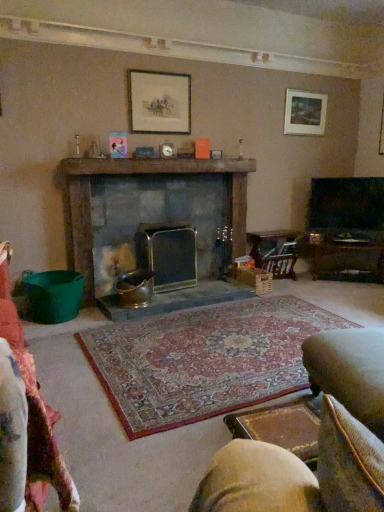
What is the approximate height of wooden magazine rack at center-right?

20.85 inches.

The image size is (384, 512). I want to click on wooden magazine rack at center-right, so click(276, 251).

At what (x,y) coordinates should I click in order to perform the action: click on metallic silver fireplace at center, the second fireplace viewed from the left. Please return your answer as a coordinate pair (x, y). This screenshot has height=512, width=384. Looking at the image, I should click on (168, 254).

Locate an element on the screen. The width and height of the screenshot is (384, 512). matte wooden picture frame at upper center, arranged as the first picture frame when viewed from the front is located at coordinates (159, 102).

The image size is (384, 512). Describe the element at coordinates (159, 102) in the screenshot. I see `matte wooden picture frame at upper center, which is the second picture frame in right-to-left order` at that location.

Locate an element on the screen. The image size is (384, 512). matte wooden picture frame at upper right, which is the 2th picture frame in left-to-right order is located at coordinates (304, 113).

The width and height of the screenshot is (384, 512). Find the location of `velvet beige swivel chair at lower right, acting as the 2th swivel chair starting from the front`. velvet beige swivel chair at lower right, acting as the 2th swivel chair starting from the front is located at coordinates (349, 371).

This screenshot has width=384, height=512. In order to click on leather cushioned swivel chair at lower right, the first swivel chair from the front in this screenshot , I will do 318,440.

Image resolution: width=384 pixels, height=512 pixels. I want to click on picture frame that is on the right side of rustic stone fireplace at center, which is counted as the 1th fireplace, starting from the left, so click(x=304, y=113).

Is matte wooden picture frame at upper right, which ranks as the first picture frame in right-to-left order, surrounding rustic stone fireplace at center, which is counted as the 1th fireplace, starting from the left?

No, matte wooden picture frame at upper right, which ranks as the first picture frame in right-to-left order, does not contain rustic stone fireplace at center, which is counted as the 1th fireplace, starting from the left.

Looking at the image, does matte wooden picture frame at upper right, the 1th picture frame viewed from the back, seem bigger or smaller compared to rustic stone fireplace at center, positioned as the 2th fireplace in right-to-left order?

Considering their sizes, matte wooden picture frame at upper right, the 1th picture frame viewed from the back, takes up less space than rustic stone fireplace at center, positioned as the 2th fireplace in right-to-left order.

Is matte wooden picture frame at upper right, which ranks as the first picture frame in right-to-left order, taller than rustic stone fireplace at center, which is counted as the 1th fireplace, starting from the left?

No.

Measure the distance between rustic stone fireplace at center, which is counted as the 1th fireplace, starting from the left, and leather cushioned swivel chair at lower right, the first swivel chair from the front.

They are 2.21 meters apart.

Is rustic stone fireplace at center, which is counted as the 1th fireplace, starting from the left, at the right side of leather cushioned swivel chair at lower right, positioned as the second swivel chair in right-to-left order?

No, rustic stone fireplace at center, which is counted as the 1th fireplace, starting from the left, is not to the right of leather cushioned swivel chair at lower right, positioned as the second swivel chair in right-to-left order.

Consider the image. Is rustic stone fireplace at center, which is counted as the 1th fireplace, starting from the left, facing towards leather cushioned swivel chair at lower right, arranged as the 2th swivel chair when viewed from the back?

Yes, rustic stone fireplace at center, which is counted as the 1th fireplace, starting from the left, is turned towards leather cushioned swivel chair at lower right, arranged as the 2th swivel chair when viewed from the back.

Between rustic stone fireplace at center, which is counted as the 1th fireplace, starting from the left, and leather cushioned swivel chair at lower right, the first swivel chair from the front, which one has larger size?

With larger size is rustic stone fireplace at center, which is counted as the 1th fireplace, starting from the left.

At what (x,y) coordinates should I click in order to perform the action: click on picture frame on the left of rustic stone fireplace at center, which is counted as the 1th fireplace, starting from the left. Please return your answer as a coordinate pair (x, y). The width and height of the screenshot is (384, 512). Looking at the image, I should click on (159, 102).

Is rustic stone fireplace at center, which is counted as the 1th fireplace, starting from the left, shorter than matte wooden picture frame at upper center, the first picture frame positioned from the left?

In fact, rustic stone fireplace at center, which is counted as the 1th fireplace, starting from the left, may be taller than matte wooden picture frame at upper center, the first picture frame positioned from the left.

From the image's perspective, relative to matte wooden picture frame at upper center, the first picture frame positioned from the left, is rustic stone fireplace at center, which is counted as the 1th fireplace, starting from the left, above or below?

From the image's perspective, rustic stone fireplace at center, which is counted as the 1th fireplace, starting from the left, appears below matte wooden picture frame at upper center, the first picture frame positioned from the left.

Which of these two, rustic stone fireplace at center, which is counted as the 1th fireplace, starting from the left, or matte wooden picture frame at upper center, arranged as the first picture frame when viewed from the front, is smaller?

With smaller size is matte wooden picture frame at upper center, arranged as the first picture frame when viewed from the front.

From a real-world perspective, is velvet beige swivel chair at lower right, acting as the 2th swivel chair starting from the front, under matte wooden picture frame at upper center, arranged as the first picture frame when viewed from the front?

Indeed, from a real-world perspective, velvet beige swivel chair at lower right, acting as the 2th swivel chair starting from the front, is positioned beneath matte wooden picture frame at upper center, arranged as the first picture frame when viewed from the front.

Is velvet beige swivel chair at lower right, acting as the 2th swivel chair starting from the front, far away from matte wooden picture frame at upper center, which is the second picture frame in right-to-left order?

Yes.

Considering the positions of objects velvet beige swivel chair at lower right, positioned as the second swivel chair in left-to-right order, and matte wooden picture frame at upper center, arranged as the first picture frame when viewed from the front, in the image provided, who is behind, velvet beige swivel chair at lower right, positioned as the second swivel chair in left-to-right order, or matte wooden picture frame at upper center, arranged as the first picture frame when viewed from the front,?

matte wooden picture frame at upper center, arranged as the first picture frame when viewed from the front, is further away from the camera.

From the image's perspective, is velvet beige swivel chair at lower right, acting as the 2th swivel chair starting from the front, located above or below matte wooden picture frame at upper center, arranged as the first picture frame when viewed from the front?

velvet beige swivel chair at lower right, acting as the 2th swivel chair starting from the front, is situated lower than matte wooden picture frame at upper center, arranged as the first picture frame when viewed from the front, in the image.

Is matte wooden picture frame at upper right, which is counted as the 2th picture frame, starting from the front, bigger than metallic silver fireplace at center, the second fireplace viewed from the left?

Incorrect, matte wooden picture frame at upper right, which is counted as the 2th picture frame, starting from the front, is not larger than metallic silver fireplace at center, the second fireplace viewed from the left.

Could you tell me if matte wooden picture frame at upper right, the 1th picture frame viewed from the back, is turned towards metallic silver fireplace at center, the second fireplace viewed from the left?

No.

From a real-world perspective, which is physically above, matte wooden picture frame at upper right, which is counted as the 2th picture frame, starting from the front, or metallic silver fireplace at center, which is counted as the 1th fireplace, starting from the right?

matte wooden picture frame at upper right, which is counted as the 2th picture frame, starting from the front, is physically above.

Measure the distance between matte wooden picture frame at upper right, the 1th picture frame viewed from the back, and metallic silver fireplace at center, which is counted as the 1th fireplace, starting from the right.

matte wooden picture frame at upper right, the 1th picture frame viewed from the back, is 1.82 meters from metallic silver fireplace at center, which is counted as the 1th fireplace, starting from the right.

Is wooden magazine rack at center-right facing away from matte wooden picture frame at upper center, arranged as the first picture frame when viewed from the front?

No, wooden magazine rack at center-right is not facing the opposite direction of matte wooden picture frame at upper center, arranged as the first picture frame when viewed from the front.

From the image's perspective, relative to matte wooden picture frame at upper center, the first picture frame positioned from the left, is wooden magazine rack at center-right above or below?

Based on their image positions, wooden magazine rack at center-right is located beneath matte wooden picture frame at upper center, the first picture frame positioned from the left.

Is point (258, 247) closer or farther from the camera than point (149, 133)?

Clearly, point (258, 247) is more distant from the camera than point (149, 133).

Could you measure the distance between wooden magazine rack at center-right and matte wooden picture frame at upper center, which is the second picture frame in right-to-left order?

wooden magazine rack at center-right is 1.54 meters from matte wooden picture frame at upper center, which is the second picture frame in right-to-left order.

Which is in front, matte wooden picture frame at upper center, the first picture frame positioned from the left, or wooden magazine rack at center-right?

Positioned in front is matte wooden picture frame at upper center, the first picture frame positioned from the left.

Image resolution: width=384 pixels, height=512 pixels. In order to click on table located behind the matte wooden picture frame at upper center, arranged as the first picture frame when viewed from the front in this screenshot , I will do `click(276, 251)`.

Between point (158, 88) and point (281, 238), which one is positioned behind?

The point (281, 238) is behind.

Which of these two, matte wooden picture frame at upper center, the second picture frame viewed from the back, or wooden magazine rack at center-right, stands taller?

With more height is matte wooden picture frame at upper center, the second picture frame viewed from the back.

Which fireplace is the 2nd one when counting from the left side of the matte wooden picture frame at upper right, which is the 2th picture frame in left-to-right order? Please provide its 2D coordinates.

[(133, 174)]

This screenshot has height=512, width=384. What are the coordinates of `the 1st fireplace behind the leather cushioned swivel chair at lower right, positioned as the second swivel chair in right-to-left order, counting from the anchor's position` in the screenshot? It's located at [x=133, y=174].

Based on their spatial positions, is matte wooden picture frame at upper center, the first picture frame positioned from the left, or velvet beige swivel chair at lower right, acting as the 2th swivel chair starting from the front, closer to metallic silver fireplace at center, which is counted as the 1th fireplace, starting from the right?

matte wooden picture frame at upper center, the first picture frame positioned from the left, lies closer to metallic silver fireplace at center, which is counted as the 1th fireplace, starting from the right, than the other object.

From the image, which object appears to be nearer to metallic silver fireplace at center, the second fireplace viewed from the left, velvet beige swivel chair at lower right, positioned as the second swivel chair in left-to-right order, or wooden magazine rack at center-right?

wooden magazine rack at center-right lies closer to metallic silver fireplace at center, the second fireplace viewed from the left, than the other object.

In the scene shown: When comparing their distances from matte wooden picture frame at upper center, the second picture frame viewed from the back, does velvet beige swivel chair at lower right, acting as the 2th swivel chair starting from the front, or rustic stone fireplace at center, which is counted as the 1th fireplace, starting from the left, seem further?

velvet beige swivel chair at lower right, acting as the 2th swivel chair starting from the front.

Estimate the real-world distances between objects in this image. Which object is closer to rustic stone fireplace at center, which is counted as the 1th fireplace, starting from the left, leather cushioned swivel chair at lower right, arranged as the 2th swivel chair when viewed from the back, or velvet beige swivel chair at lower right, positioned as the second swivel chair in left-to-right order?

leather cushioned swivel chair at lower right, arranged as the 2th swivel chair when viewed from the back, is positioned closer to the anchor rustic stone fireplace at center, which is counted as the 1th fireplace, starting from the left.

When comparing their distances from matte wooden picture frame at upper center, which is the second picture frame in right-to-left order, does wooden magazine rack at center-right or leather cushioned swivel chair at lower right, arranged as the 2th swivel chair when viewed from the back, seem further?

The object further to matte wooden picture frame at upper center, which is the second picture frame in right-to-left order, is leather cushioned swivel chair at lower right, arranged as the 2th swivel chair when viewed from the back.

From the picture: Based on their spatial positions, is metallic silver fireplace at center, the second fireplace viewed from the left, or matte wooden picture frame at upper center, arranged as the first picture frame when viewed from the front, closer to rustic stone fireplace at center, positioned as the 2th fireplace in right-to-left order?

Among the two, metallic silver fireplace at center, the second fireplace viewed from the left, is located nearer to rustic stone fireplace at center, positioned as the 2th fireplace in right-to-left order.

When comparing their distances from metallic silver fireplace at center, which is counted as the 1th fireplace, starting from the right, does rustic stone fireplace at center, positioned as the 2th fireplace in right-to-left order, or leather cushioned swivel chair at lower right, the first swivel chair from the front, seem further?

leather cushioned swivel chair at lower right, the first swivel chair from the front, is positioned further to the anchor metallic silver fireplace at center, which is counted as the 1th fireplace, starting from the right.

Based on the photo, from the image, which object appears to be nearer to matte wooden picture frame at upper right, which ranks as the first picture frame in right-to-left order, leather cushioned swivel chair at lower right, the first swivel chair from the front, or rustic stone fireplace at center, which is counted as the 1th fireplace, starting from the left?

rustic stone fireplace at center, which is counted as the 1th fireplace, starting from the left, lies closer to matte wooden picture frame at upper right, which ranks as the first picture frame in right-to-left order, than the other object.

Locate an element on the screen. The width and height of the screenshot is (384, 512). picture frame that lies between matte wooden picture frame at upper right, the 1th picture frame viewed from the back, and metallic silver fireplace at center, the second fireplace viewed from the left, from top to bottom is located at coordinates (159, 102).

The width and height of the screenshot is (384, 512). Identify the location of picture frame between leather cushioned swivel chair at lower right, the 1th swivel chair from the left, and matte wooden picture frame at upper right, the 1th picture frame viewed from the back, in the front-back direction. (159, 102).

I want to click on table between matte wooden picture frame at upper center, arranged as the first picture frame when viewed from the front, and metallic silver fireplace at center, which is counted as the 1th fireplace, starting from the right, from top to bottom, so click(276, 251).

Where is `fireplace between rustic stone fireplace at center, positioned as the 2th fireplace in right-to-left order, and matte wooden picture frame at upper right, which ranks as the first picture frame in right-to-left order, in the horizontal direction`? fireplace between rustic stone fireplace at center, positioned as the 2th fireplace in right-to-left order, and matte wooden picture frame at upper right, which ranks as the first picture frame in right-to-left order, in the horizontal direction is located at coordinates (168, 254).